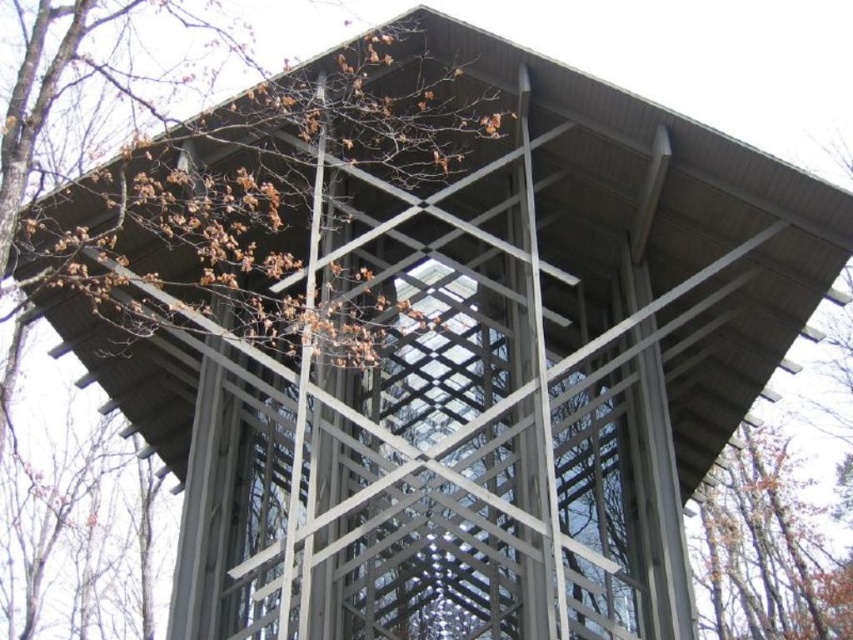
Question: Which of the following is the closest to the observer?

Choices:
 (A) (721, 460)
 (B) (287, 224)

Answer: (B)

Question: Is brown wood tree at center to the left of brown wood tree at upper right from the viewer's perspective?

Choices:
 (A) yes
 (B) no

Answer: (A)

Question: Which point is farther from the camera taking this photo?

Choices:
 (A) (346, 48)
 (B) (734, 589)

Answer: (B)

Question: Does brown wood tree at center appear over brown wood tree at upper right?

Choices:
 (A) no
 (B) yes

Answer: (B)

Question: In this image, where is brown wood tree at center located relative to brown wood tree at upper right?

Choices:
 (A) below
 (B) above

Answer: (B)